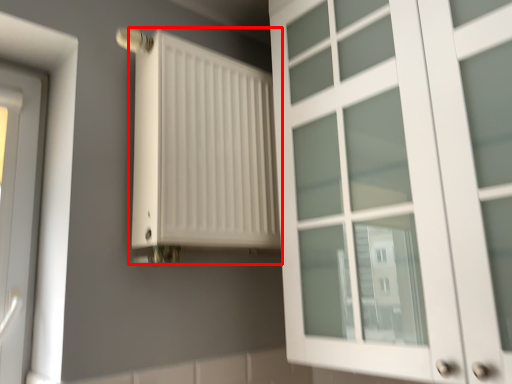
Question: From the image's perspective, what is the correct spatial positioning of radiator (annotated by the red box) in reference to cupboard?

Choices:
 (A) below
 (B) above

Answer: (A)